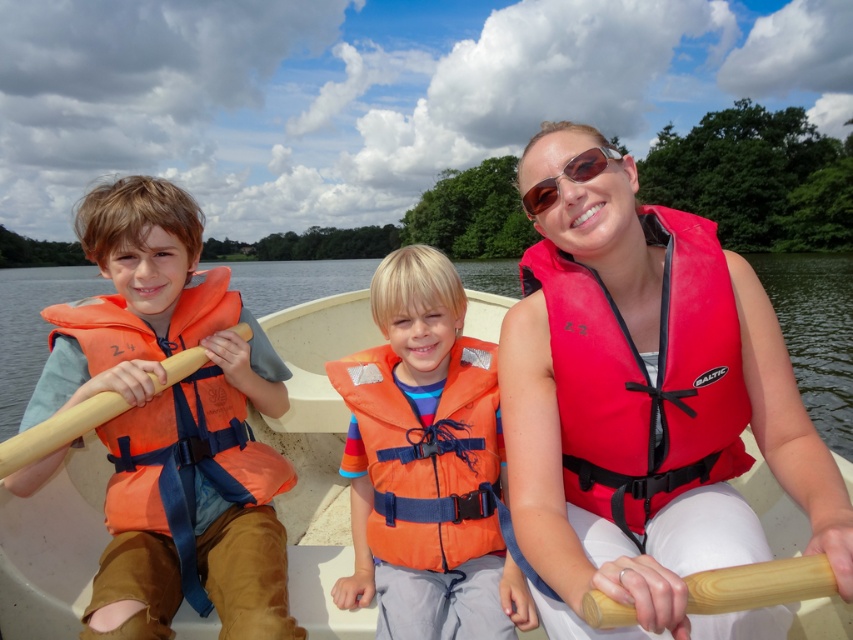
In the image, there are three people on a boat. The red nylon life vest at center is worn by whom?

The red nylon life vest at center is worn by the adult woman on the right.

You are a lifeguard on duty and need to quickly grab an object to throw to someone in the water. You see the red nylon life vest at center and the wooden paddle at left. Which object is larger and should you choose to ensure it can be seen from a distance?

The red nylon life vest at center is bigger than the wooden paddle at left, so you should choose the red nylon life vest at center to ensure it can be seen from a distance.

You are a safety inspector checking the distance between the two wooden paddles on the boat. The safety regulation requires that paddles must be at least 4 feet apart to prevent entanglement. Are the wooden paddle at center and wooden paddle at left compliant with this regulation?

The wooden paddle at center is 4.18 feet away from the wooden paddle at left, which exceeds the 4 feet requirement, so they are compliant with the safety regulation.